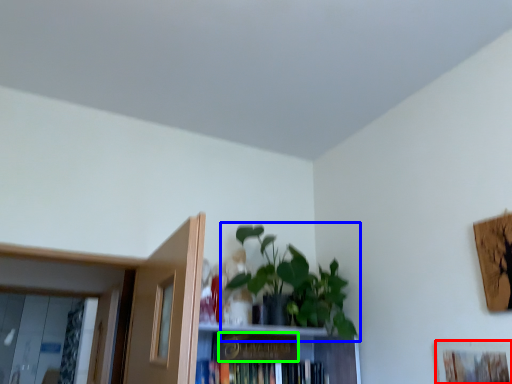
Question: Which object is the farthest from picture frame (highlighted by a red box)? Choose among these: houseplant (highlighted by a blue box) or paperback book (highlighted by a green box).

Choices:
 (A) houseplant
 (B) paperback book

Answer: (B)